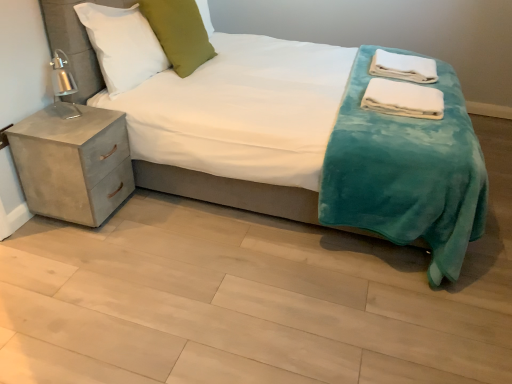
The height and width of the screenshot is (384, 512). Identify the location of vacant space situated above concrete nightstand at left (from a real-world perspective). (72, 123).